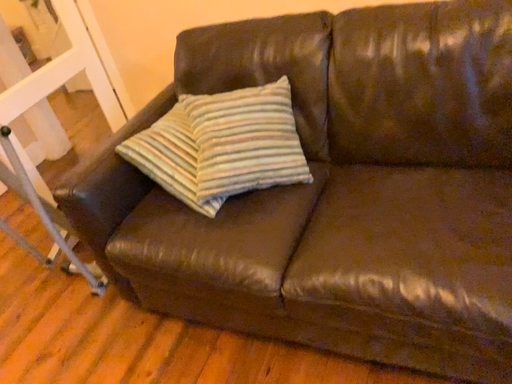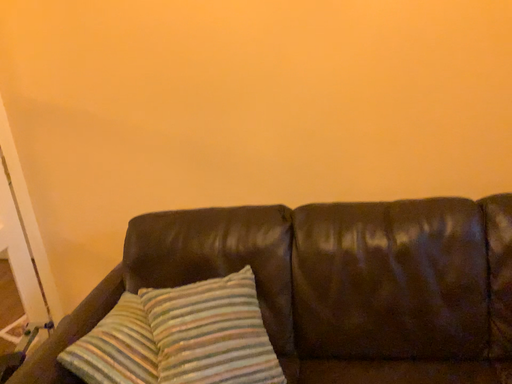
Question: How did the camera likely rotate when shooting the video?

Choices:
 (A) rotated upward
 (B) rotated downward

Answer: (A)